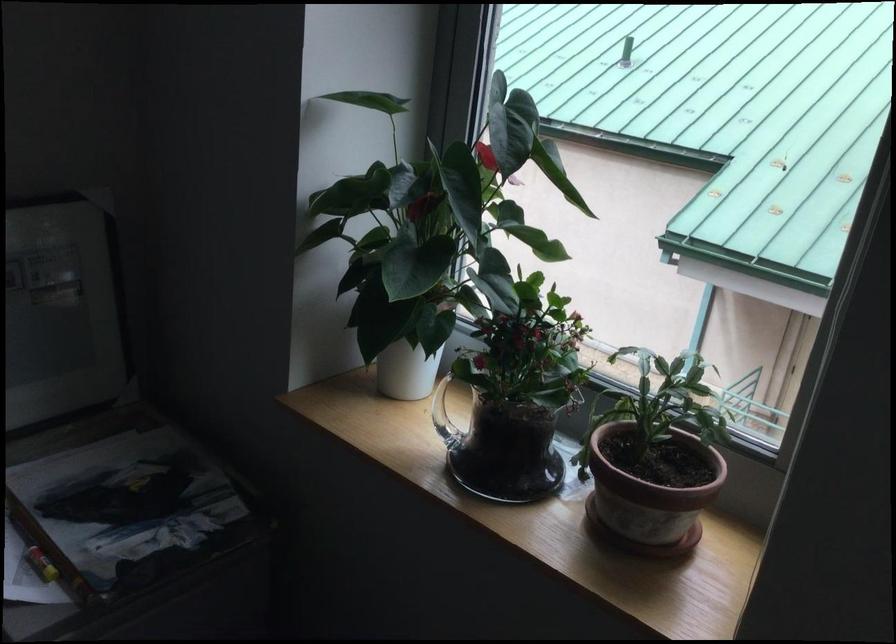
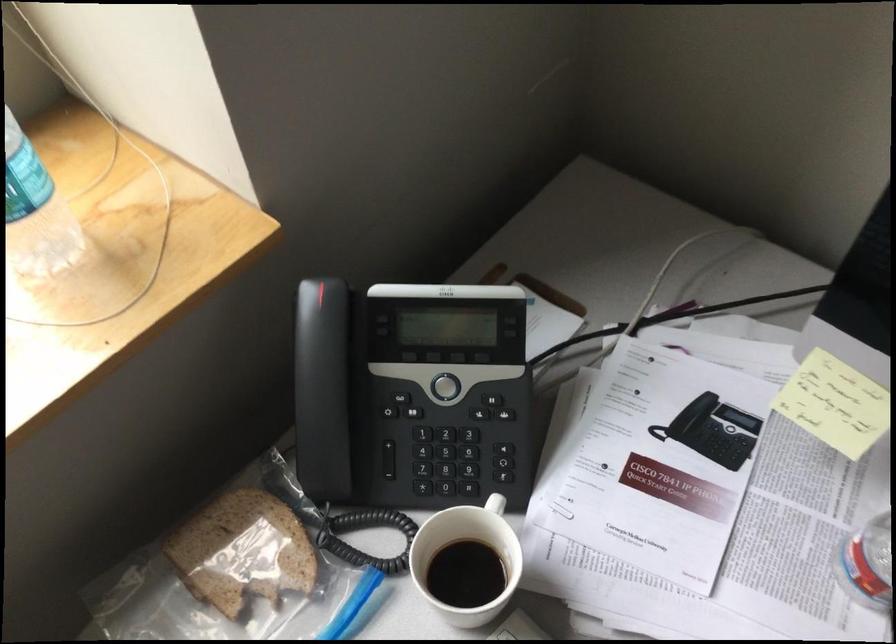
The first image is from the beginning of the video and the second image is from the end. How did the camera likely rotate when shooting the video?

The camera's rotation is toward right-down.